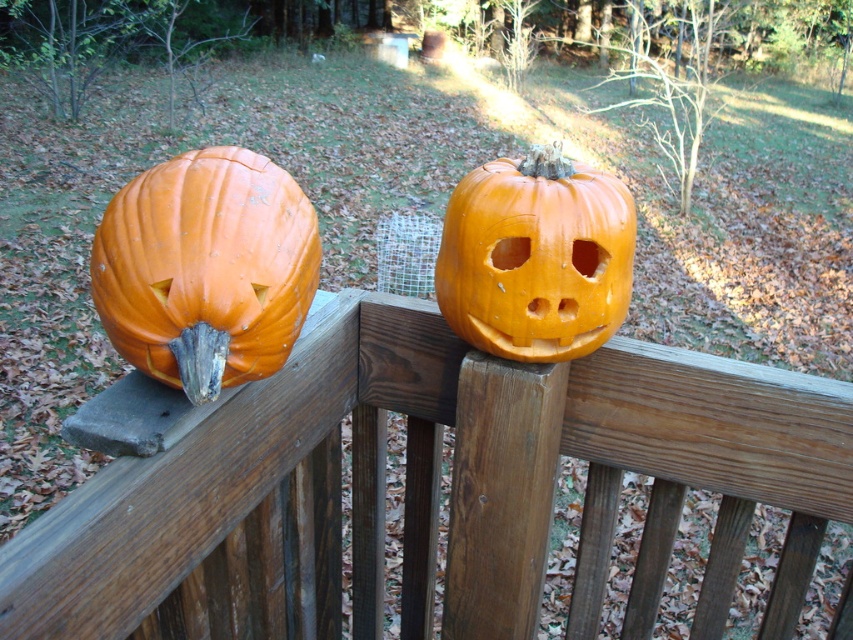
You are a painter who wants to place a new decorative item between the wooden fence at upper center and the orange matte pumpkin at left. The item must fit within the space between them. Given their sizes, can you determine if the item will fit if it is 1.2 meters wide?

The wooden fence at upper center is wider than the orange matte pumpkin at left. However, the exact width of the space between them isn t provided in the description. Without knowing the distance between the two objects, it s impossible to determine if the 1.2 meter wide item will fit.

You are a child trying to decide which pumpkin to choose for a Halloween contest. Both pumpkins are orange and matte, but you need to pick the taller one. Which one should you choose between the orange matte pumpkin at left and the orange matte pumpkin at center?

The orange matte pumpkin at left is taller than the orange matte pumpkin at center, so you should choose the orange matte pumpkin at left for the Halloween contest.

You are a painter standing on a ladder to paint the wooden fence at upper center and the orange matte pumpkin at center. Which object will require you to climb higher on the ladder?

The wooden fence at upper center is taller than the orange matte pumpkin at center, so you will need to climb higher on the ladder to reach the wooden fence at upper center.